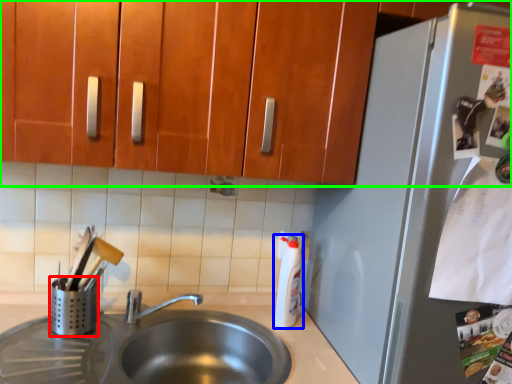
Question: Considering the real-world distances, which object is closest to appliance (highlighted by a red box)? bottle (highlighted by a blue box) or cabinetry (highlighted by a green box).

Choices:
 (A) bottle
 (B) cabinetry

Answer: (A)